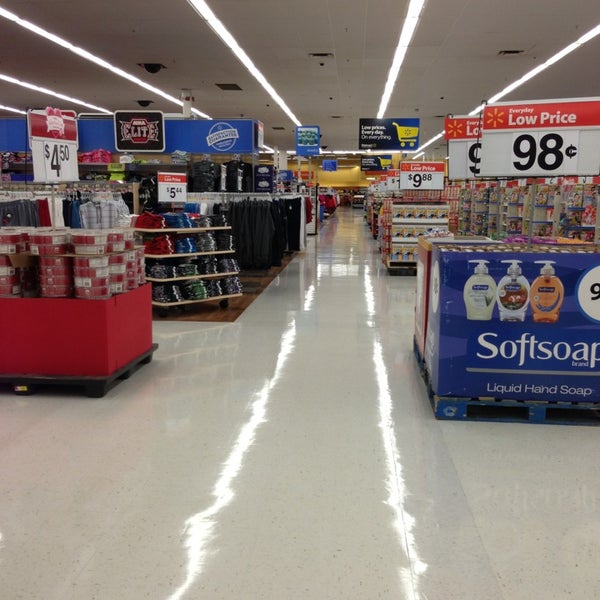
Image resolution: width=600 pixels, height=600 pixels. In order to click on floor in this screenshot , I will do `click(328, 499)`.